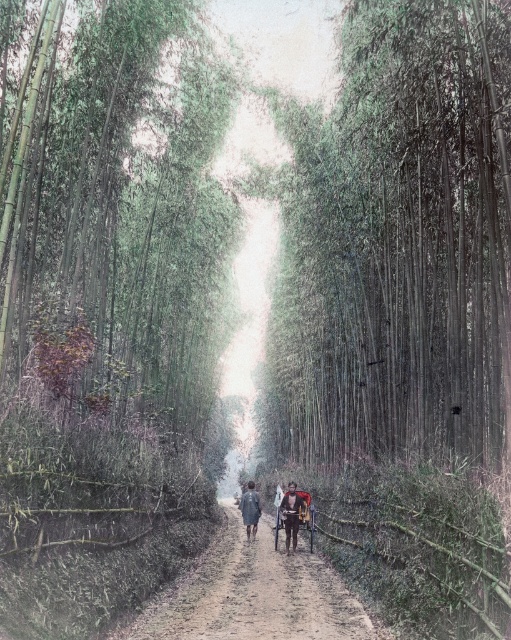
Question: Which point is farther from the camera taking this photo?

Choices:
 (A) (459, 419)
 (B) (150, 612)
 (C) (251, 490)
 (D) (293, 518)

Answer: (C)

Question: Is wooden cart at center positioned behind dark gray fabric coat at center?

Choices:
 (A) no
 (B) yes

Answer: (A)

Question: Among these objects, which one is nearest to the camera?

Choices:
 (A) dark gray fabric coat at center
 (B) wooden cart at center
 (C) green matte bamboo at center

Answer: (C)

Question: Considering the relative positions of green matte bamboo at center and dark gray fabric coat at center in the image provided, where is green matte bamboo at center located with respect to dark gray fabric coat at center?

Choices:
 (A) above
 (B) below

Answer: (A)

Question: Among these objects, which one is farthest from the camera?

Choices:
 (A) green matte bamboo at center
 (B) dark gray fabric coat at center
 (C) dusty brown dirt road at center
 (D) wooden cart at center

Answer: (B)

Question: Is green matte bamboo at center behind wooden cart at center?

Choices:
 (A) no
 (B) yes

Answer: (A)